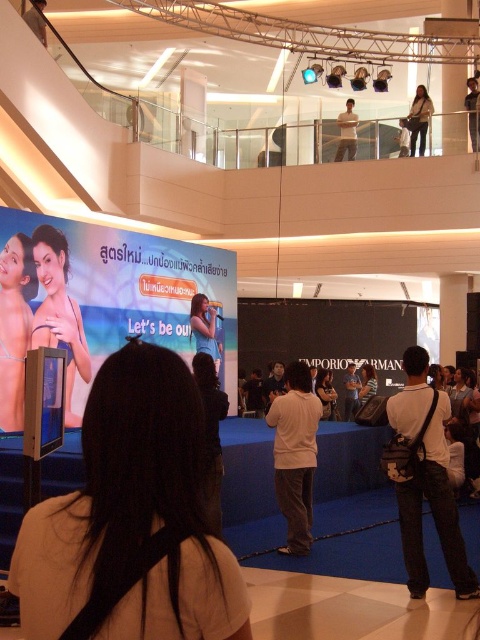
Does matte black bikini at left appear on the left side of matte black jacket at upper right?

Yes, matte black bikini at left is to the left of matte black jacket at upper right.

Who is shorter, matte black bikini at left or matte black jacket at upper right?

matte black jacket at upper right

Is point (54, 259) positioned behind point (428, 100)?

No, (54, 259) is closer to viewer.

Where is `matte black bikini at left`? matte black bikini at left is located at coordinates (59, 310).

Measure the distance between matte blue shirt at center and camera.

matte blue shirt at center and camera are 19.16 meters apart.

Image resolution: width=480 pixels, height=640 pixels. What are the coordinates of `matte blue shirt at center` in the screenshot? It's located at (204, 328).

Between point (202, 305) and point (371, 394), which one is positioned behind?

Point (371, 394)

I want to click on matte blue shirt at center, so point(204,328).

Which is above, matte black jacket at upper right or matte black dress at center?

matte black jacket at upper right is above.

How much distance is there between matte black jacket at upper right and matte black dress at center?

The distance of matte black jacket at upper right from matte black dress at center is 37.89 feet.

This screenshot has height=640, width=480. I want to click on matte black jacket at upper right, so click(x=419, y=120).

Identify the location of matte black jacket at upper right. This screenshot has height=640, width=480. (419, 120).